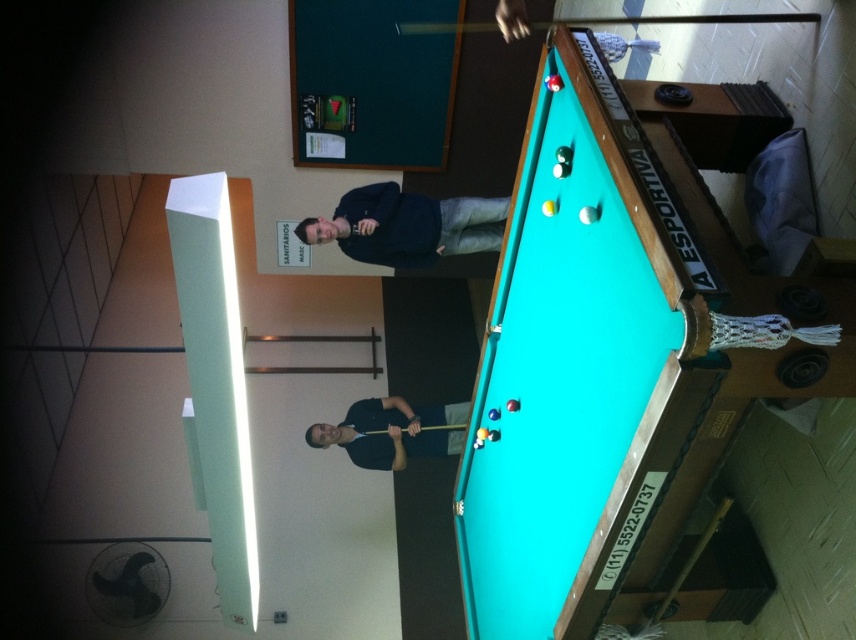
Question: Based on their relative distances, which object is farther from the wooden at center?

Choices:
 (A) dark blue sweater at upper center
 (B) dark blue shirt at center

Answer: (A)

Question: Does teal felt pool table at upper right have a greater width compared to wooden at center?

Choices:
 (A) no
 (B) yes

Answer: (B)

Question: Does teal felt pool table at upper right appear on the left side of dark blue sweater at upper center?

Choices:
 (A) yes
 (B) no

Answer: (B)

Question: Among these points, which one is farthest from the camera?

Choices:
 (A) (414, 433)
 (B) (409, 408)
 (C) (651, 173)
 (D) (461, 253)

Answer: (D)

Question: Estimate the real-world distances between objects in this image. Which object is closer to the wooden at center?

Choices:
 (A) teal felt pool table at upper right
 (B) yellow wood cue at upper center

Answer: (A)

Question: Is dark blue sweater at upper center closer to camera compared to dark blue shirt at center?

Choices:
 (A) yes
 (B) no

Answer: (A)